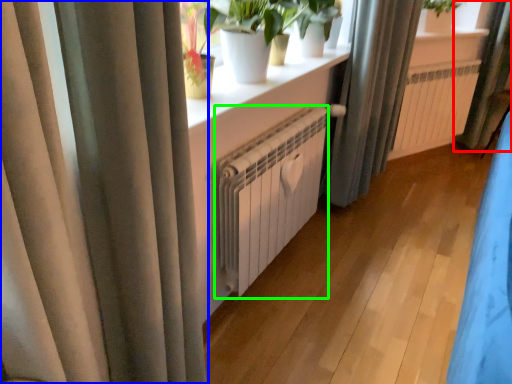
Question: Considering the real-world distances, which object is farthest from curtain (highlighted by a red box)? curtain (highlighted by a blue box) or radiator (highlighted by a green box)?

Choices:
 (A) curtain
 (B) radiator

Answer: (A)